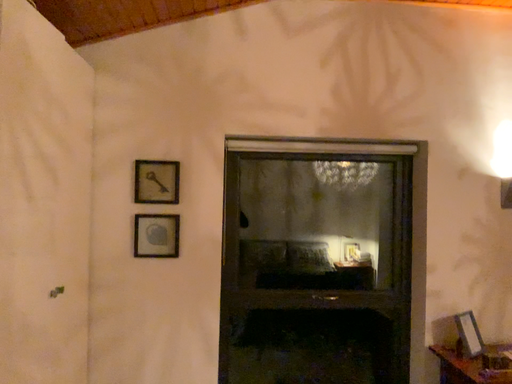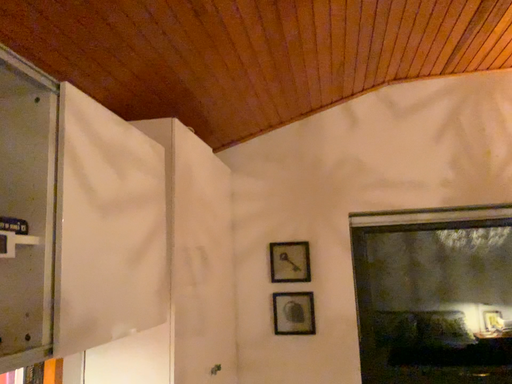
Question: How did the camera likely rotate when shooting the video?

Choices:
 (A) rotated right
 (B) rotated left

Answer: (B)